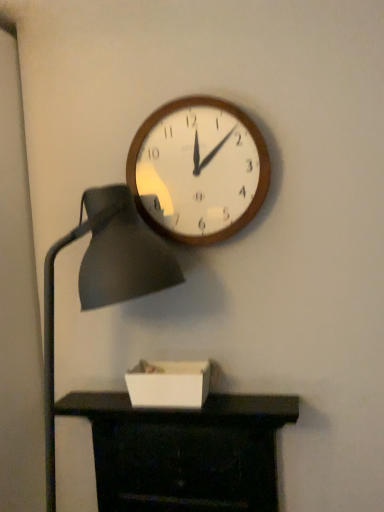
What is the approximate width of matte black lampshade at left?

15.20 inches.

What do you see at coordinates (168, 384) in the screenshot? I see `white matte box at lower center` at bounding box center [168, 384].

What do you see at coordinates (184, 452) in the screenshot? I see `matte black fireplace at lower center` at bounding box center [184, 452].

Image resolution: width=384 pixels, height=512 pixels. In order to click on wooden wall clock at upper center in this screenshot , I will do `click(198, 170)`.

At what (x,y) coordinates should I click in order to perform the action: click on matte black lampshade at left. Please return your answer as a coordinate pair (x, y). This screenshot has width=384, height=512. Looking at the image, I should click on (103, 279).

Which of these two, matte black fireplace at lower center or matte black lampshade at left, is thinner?

With smaller width is matte black fireplace at lower center.

From a real-world perspective, is matte black fireplace at lower center positioned under matte black lampshade at left based on gravity?

Answer: Yes, from a real-world perspective, matte black fireplace at lower center is below matte black lampshade at left.

Would you say matte black fireplace at lower center is inside or outside matte black lampshade at left?

matte black fireplace at lower center lies outside matte black lampshade at left.

Locate an element on the screen. This screenshot has height=512, width=384. furniture behind the matte black lampshade at left is located at coordinates (184, 452).

Is point (249, 121) more distant than point (212, 410)?

Yes, point (249, 121) is behind point (212, 410).

Based on the photo, how distant is wooden wall clock at upper center from matte black fireplace at lower center?

A distance of 27.22 inches exists between wooden wall clock at upper center and matte black fireplace at lower center.

Is wooden wall clock at upper center completely or partially outside of matte black fireplace at lower center?

wooden wall clock at upper center lies outside matte black fireplace at lower center's area.

Is point (261, 138) positioned before point (135, 381)?

Yes, it is in front of point (135, 381).

Can you confirm if wooden wall clock at upper center is positioned to the right of white matte box at lower center?

Indeed, wooden wall clock at upper center is positioned on the right side of white matte box at lower center.

Is the surface of wooden wall clock at upper center in direct contact with white matte box at lower center?

No, wooden wall clock at upper center is not next to white matte box at lower center.

Is white matte box at lower center at the back of wooden wall clock at upper center?

No, wooden wall clock at upper center is not facing the opposite direction of white matte box at lower center.

Considering the sizes of objects matte black lampshade at left and white matte box at lower center in the image provided, who is smaller, matte black lampshade at left or white matte box at lower center?

Smaller between the two is white matte box at lower center.

In order to click on box behind the matte black lampshade at left in this screenshot , I will do `click(168, 384)`.

Are matte black lampshade at left and white matte box at lower center beside each other?

matte black lampshade at left and white matte box at lower center are clearly separated.

Considering the relative positions of matte black lampshade at left and white matte box at lower center in the image provided, is matte black lampshade at left to the left or to the right of white matte box at lower center?

From the image, it's evident that matte black lampshade at left is to the left of white matte box at lower center.

From the image's perspective, which is above, matte black fireplace at lower center or white matte box at lower center?

white matte box at lower center, from the image's perspective.

Does matte black fireplace at lower center touch white matte box at lower center?

No, matte black fireplace at lower center is not next to white matte box at lower center.

Who is more distant, matte black fireplace at lower center or white matte box at lower center?

white matte box at lower center is further away from the camera.

From a real-world perspective, is white matte box at lower center below matte black fireplace at lower center?

Actually, white matte box at lower center is physically above matte black fireplace at lower center in the real world.

Considering the sizes of objects white matte box at lower center and matte black fireplace at lower center in the image provided, who is smaller, white matte box at lower center or matte black fireplace at lower center?

Smaller between the two is white matte box at lower center.

Which object is thinner, white matte box at lower center or matte black fireplace at lower center?

white matte box at lower center.

Can you confirm if white matte box at lower center is taller than matte black fireplace at lower center?

No, white matte box at lower center is not taller than matte black fireplace at lower center.

Does point (140, 376) come farther from viewer compared to point (120, 294)?

Yes, point (140, 376) is behind point (120, 294).

In the scene shown: Is white matte box at lower center in contact with matte black lampshade at left?

They are not placed beside each other.

Does white matte box at lower center have a lesser width compared to matte black lampshade at left?

Correct, the width of white matte box at lower center is less than that of matte black lampshade at left.

In terms of size, does white matte box at lower center appear bigger or smaller than matte black lampshade at left?

Considering their sizes, white matte box at lower center takes up less space than matte black lampshade at left.

You are a GUI agent. You are given a task and a screenshot of the screen. Output one action in this format:
    pyautogui.click(x=<x>, y=<y>)
    Task: Click on the furniture on the right of matte black lampshade at left
    
    Given the screenshot: What is the action you would take?
    pyautogui.click(x=184, y=452)

You are a GUI agent. You are given a task and a screenshot of the screen. Output one action in this format:
    pyautogui.click(x=<x>, y=<y>)
    Task: Click on the furniture on the left side of wooden wall clock at upper center
    The height and width of the screenshot is (512, 384).
    Given the screenshot: What is the action you would take?
    pyautogui.click(x=184, y=452)

Looking at the image, which one is located further to wooden wall clock at upper center, matte black lampshade at left or white matte box at lower center?

The object further to wooden wall clock at upper center is white matte box at lower center.

Which object lies nearer to the anchor point matte black fireplace at lower center, matte black lampshade at left or white matte box at lower center?

white matte box at lower center.

When comparing their distances from matte black fireplace at lower center, does white matte box at lower center or matte black lampshade at left seem closer?

The object closer to matte black fireplace at lower center is white matte box at lower center.

From the image, which object appears to be farther from white matte box at lower center, matte black lampshade at left or wooden wall clock at upper center?

wooden wall clock at upper center lies further to white matte box at lower center than the other object.

Based on their spatial positions, is white matte box at lower center or wooden wall clock at upper center further from matte black fireplace at lower center?

wooden wall clock at upper center is positioned further to the anchor matte black fireplace at lower center.

Which object lies nearer to the anchor point white matte box at lower center, matte black fireplace at lower center or matte black lampshade at left?

Based on the image, matte black fireplace at lower center appears to be nearer to white matte box at lower center.

Based on their spatial positions, is white matte box at lower center or matte black lampshade at left closer to wooden wall clock at upper center?

matte black lampshade at left.

Looking at this image, which object lies further to the anchor point matte black lampshade at left, white matte box at lower center or matte black fireplace at lower center?

matte black fireplace at lower center is positioned further to the anchor matte black lampshade at left.

Image resolution: width=384 pixels, height=512 pixels. I want to click on table lamp between wooden wall clock at upper center and matte black fireplace at lower center from top to bottom, so click(x=103, y=279).

Find the location of `box between wooden wall clock at upper center and matte black fireplace at lower center vertically`. box between wooden wall clock at upper center and matte black fireplace at lower center vertically is located at coordinates pyautogui.click(x=168, y=384).

What are the coordinates of `table lamp between wooden wall clock at upper center and white matte box at lower center in the vertical direction` in the screenshot? It's located at (103, 279).

Find the location of a particular element. box between matte black lampshade at left and matte black fireplace at lower center from top to bottom is located at coordinates (168, 384).